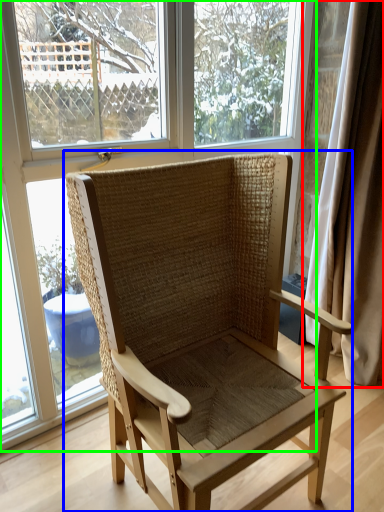
Question: Which object is the farthest from curtain (highlighted by a red box)? Choose among these: chair (highlighted by a blue box) or window (highlighted by a green box).

Choices:
 (A) chair
 (B) window

Answer: (A)